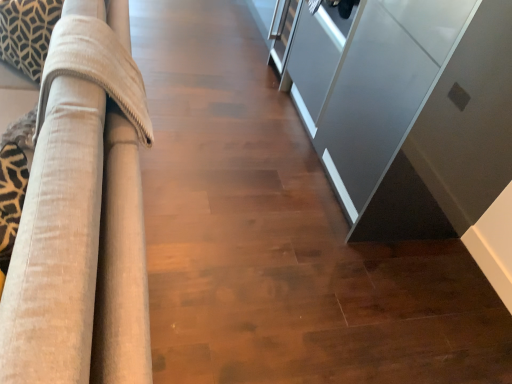
Question: From the image's perspective, does satin gray cabinet at right appear lower than beige fabric couch at left?

Choices:
 (A) yes
 (B) no

Answer: (A)

Question: Does satin gray cabinet at right contain beige fabric couch at left?

Choices:
 (A) no
 (B) yes

Answer: (A)

Question: Is satin gray cabinet at right next to beige fabric couch at left?

Choices:
 (A) yes
 (B) no

Answer: (B)

Question: From the image's perspective, is satin gray cabinet at right located above beige fabric couch at left?

Choices:
 (A) no
 (B) yes

Answer: (A)

Question: From a real-world perspective, is satin gray cabinet at right located beneath beige fabric couch at left?

Choices:
 (A) yes
 (B) no

Answer: (B)

Question: Does satin gray cabinet at right have a greater height compared to beige fabric couch at left?

Choices:
 (A) yes
 (B) no

Answer: (A)

Question: Is the depth of satin gray cabinet at right greater than that of patterned fabric pillow at upper left?

Choices:
 (A) yes
 (B) no

Answer: (B)

Question: Is satin gray cabinet at right positioned with its back to patterned fabric pillow at upper left?

Choices:
 (A) no
 (B) yes

Answer: (A)

Question: Could you tell me if satin gray cabinet at right is facing patterned fabric pillow at upper left?

Choices:
 (A) no
 (B) yes

Answer: (B)

Question: Is satin gray cabinet at right wider than patterned fabric pillow at upper left?

Choices:
 (A) no
 (B) yes

Answer: (B)

Question: Does satin gray cabinet at right appear on the left side of patterned fabric pillow at upper left?

Choices:
 (A) no
 (B) yes

Answer: (A)

Question: Is satin gray cabinet at right next to patterned fabric pillow at upper left and touching it?

Choices:
 (A) no
 (B) yes

Answer: (A)

Question: Is beige fabric couch at left completely or partially outside of satin gray cabinet at right?

Choices:
 (A) no
 (B) yes

Answer: (B)